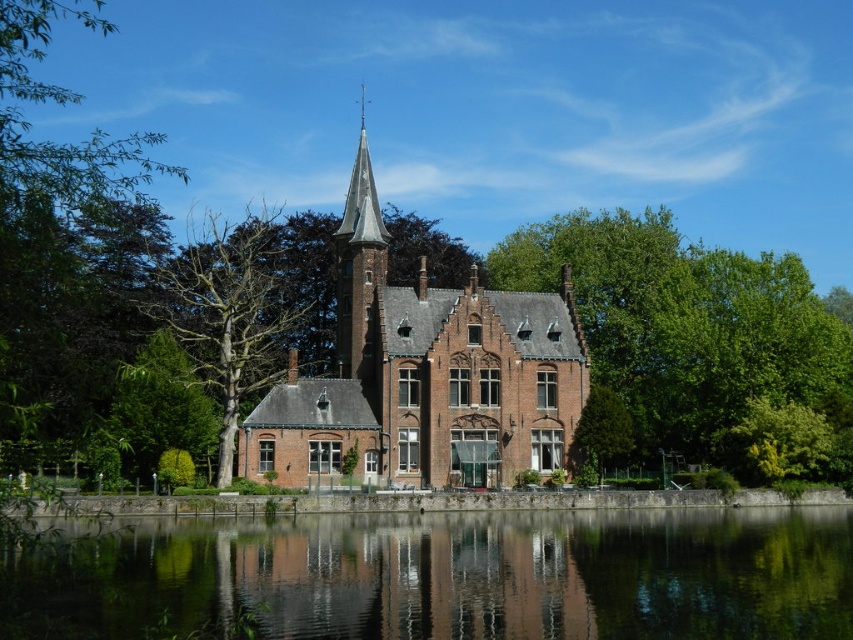
You are a bird looking for a nesting spot. You see the green leafy tree at right and the bare wood tree at left. Which tree would be a better choice for nesting based on their height?

The green leafy tree at right is taller than the bare wood tree at left, so it would provide a better nesting spot due to its greater height.

You are standing in front of the historic brick building by the water. You notice a green leafy tree at right and a smooth brick tower at center. Which object is closer to the water?

The green leafy tree at right is positioned under the smooth brick tower at center, meaning it is closer to the water than the tower.